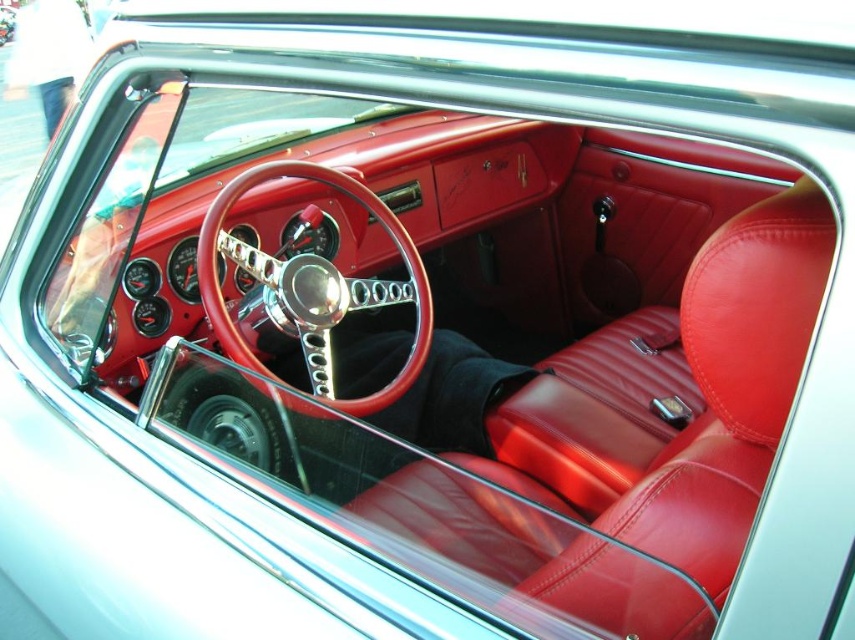
Which is below, shiny red leather steering wheel at center or metallic silver wheel at center?

metallic silver wheel at center

Can you confirm if shiny red leather steering wheel at center is positioned above metallic silver wheel at center?

Indeed, shiny red leather steering wheel at center is positioned over metallic silver wheel at center.

Between point (397, 380) and point (219, 445), which one is positioned in front?

Positioned in front is point (219, 445).

At what (x,y) coordinates should I click in order to perform the action: click on shiny red leather steering wheel at center. Please return your answer as a coordinate pair (x, y). Looking at the image, I should click on (311, 289).